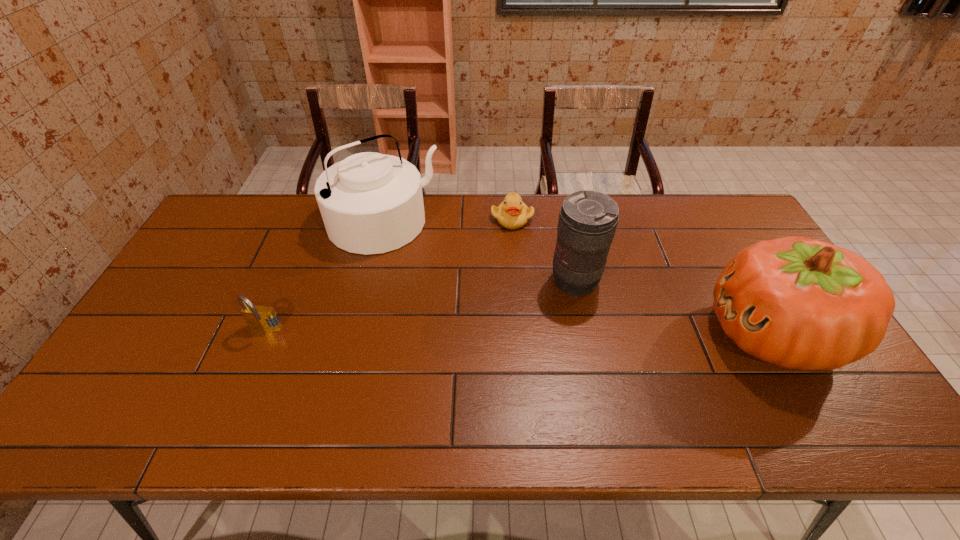
I want to click on free spot on the desktop that is between the leftmost object and the pumpkin and is positioned on the side of the fourth object from left to right where the control switches are located, so click(496, 332).

The image size is (960, 540). Identify the location of vacant spot on the desktop that is between the second shortest object and the rightmost object and is positioned on the spout of the kettle. (473, 332).

Where is `free space on the desktop that is between the leftmost object and the pumpkin and is positioned on the front-facing side of the third object from left to right`? The width and height of the screenshot is (960, 540). free space on the desktop that is between the leftmost object and the pumpkin and is positioned on the front-facing side of the third object from left to right is located at coordinates (586, 333).